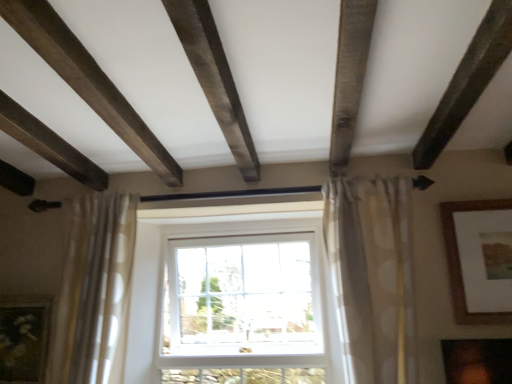
Question: From a real-world perspective, is white plastic window at center positioned over matte gold picture frame at lower left, the first picture frame when ordered from left to right, based on gravity?

Choices:
 (A) no
 (B) yes

Answer: (B)

Question: Could matte gold picture frame at lower left, the 2th picture frame in the top-to-bottom sequence, be considered to be inside white plastic window at center?

Choices:
 (A) no
 (B) yes

Answer: (A)

Question: Considering the relative positions of white plastic window at center and matte gold picture frame at lower left, the 2th picture frame in the top-to-bottom sequence, in the image provided, is white plastic window at center to the right of matte gold picture frame at lower left, the 2th picture frame in the top-to-bottom sequence, from the viewer's perspective?

Choices:
 (A) yes
 (B) no

Answer: (A)

Question: Does white plastic window at center appear on the left side of matte gold picture frame at lower left, the first picture frame when ordered from left to right?

Choices:
 (A) no
 (B) yes

Answer: (A)

Question: Does white plastic window at center lie in front of matte gold picture frame at lower left, marked as the 1th picture frame in a bottom-to-top arrangement?

Choices:
 (A) no
 (B) yes

Answer: (A)

Question: Which is correct: brown wooden picture frame at upper right, acting as the 2th picture frame starting from the left, is inside dark brown wood plank at upper center, or outside of it?

Choices:
 (A) outside
 (B) inside

Answer: (A)

Question: From a real-world perspective, is brown wooden picture frame at upper right, marked as the 1th picture frame in a top-to-bottom arrangement, positioned above or below dark brown wood plank at upper center?

Choices:
 (A) above
 (B) below

Answer: (B)

Question: Based on their positions, is brown wooden picture frame at upper right, the 2th picture frame when ordered from bottom to top, located to the left or right of dark brown wood plank at upper center?

Choices:
 (A) right
 (B) left

Answer: (A)

Question: From their relative heights in the image, would you say brown wooden picture frame at upper right, acting as the 2th picture frame starting from the left, is taller or shorter than dark brown wood plank at upper center?

Choices:
 (A) short
 (B) tall

Answer: (B)

Question: From the image's perspective, relative to brown wooden picture frame at upper right, marked as the 1th picture frame in a top-to-bottom arrangement, is dark brown wood plank at upper center above or below?

Choices:
 (A) above
 (B) below

Answer: (A)

Question: Is dark brown wood plank at upper center in front of or behind brown wooden picture frame at upper right, marked as the 1th picture frame in a top-to-bottom arrangement, in the image?

Choices:
 (A) front
 (B) behind

Answer: (A)

Question: From a real-world perspective, is dark brown wood plank at upper center above or below brown wooden picture frame at upper right, positioned as the first picture frame in right-to-left order?

Choices:
 (A) above
 (B) below

Answer: (A)

Question: In terms of size, does dark brown wood plank at upper center appear bigger or smaller than brown wooden picture frame at upper right, positioned as the first picture frame in right-to-left order?

Choices:
 (A) small
 (B) big

Answer: (B)

Question: Is beige dotted fabric curtain at left, which is the 1th curtain from left to right, spatially inside dark brown wood plank at upper center, or outside of it?

Choices:
 (A) outside
 (B) inside

Answer: (A)

Question: From the image's perspective, is beige dotted fabric curtain at left, which is the 1th curtain from left to right, positioned above or below dark brown wood plank at upper center?

Choices:
 (A) below
 (B) above

Answer: (A)